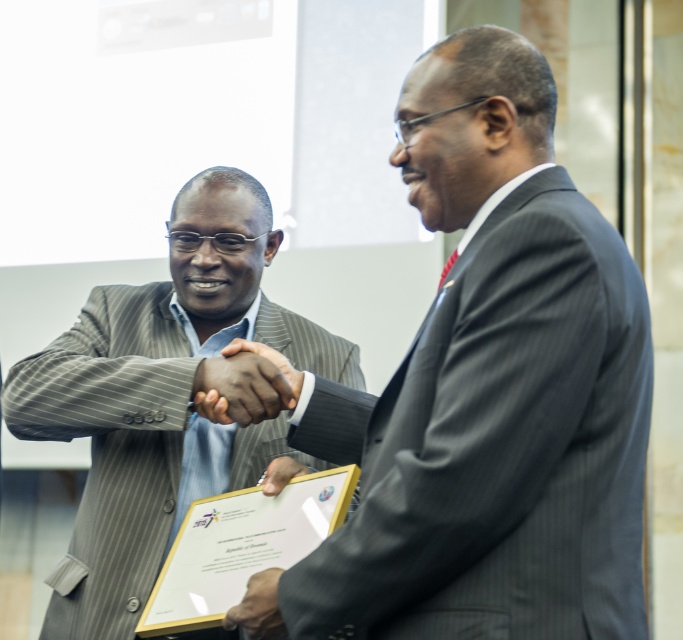
In the scene shown: Does gray pinstripe suit at center have a smaller size compared to dark brown leather hand at center?

Incorrect, gray pinstripe suit at center is not smaller in size than dark brown leather hand at center.

Can you confirm if gray pinstripe suit at center is shorter than dark brown leather hand at center?

No.

Which is in front, point (130, 448) or point (240, 608)?

Point (240, 608) is more forward.

At what (x,y) coordinates should I click in order to perform the action: click on gray pinstripe suit at center. Please return your answer as a coordinate pair (x, y). Looking at the image, I should click on (161, 397).

Who is lower down, dark brown leather hand at center or matte black hand at center?

dark brown leather hand at center

Identify the location of dark brown leather hand at center. The height and width of the screenshot is (640, 683). (257, 605).

What are the coordinates of `dark brown leather hand at center` in the screenshot? It's located at (257, 605).

Which is in front, point (249, 608) or point (281, 355)?

Point (249, 608)

Is point (250, 589) more distant than point (268, 358)?

No, (250, 589) is in front of (268, 358).

This screenshot has height=640, width=683. I want to click on dark brown leather hand at center, so click(257, 605).